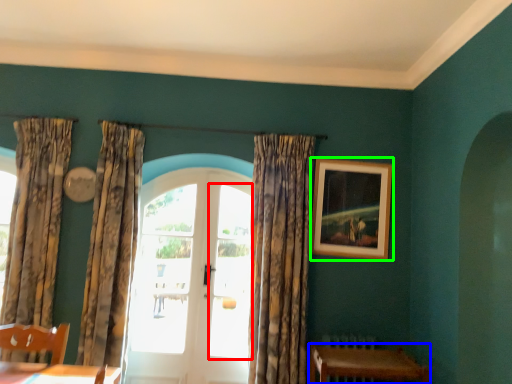
Question: Which is farther away from window (highlighted by a red box)? table (highlighted by a blue box) or picture frame (highlighted by a green box)?

Choices:
 (A) table
 (B) picture frame

Answer: (A)